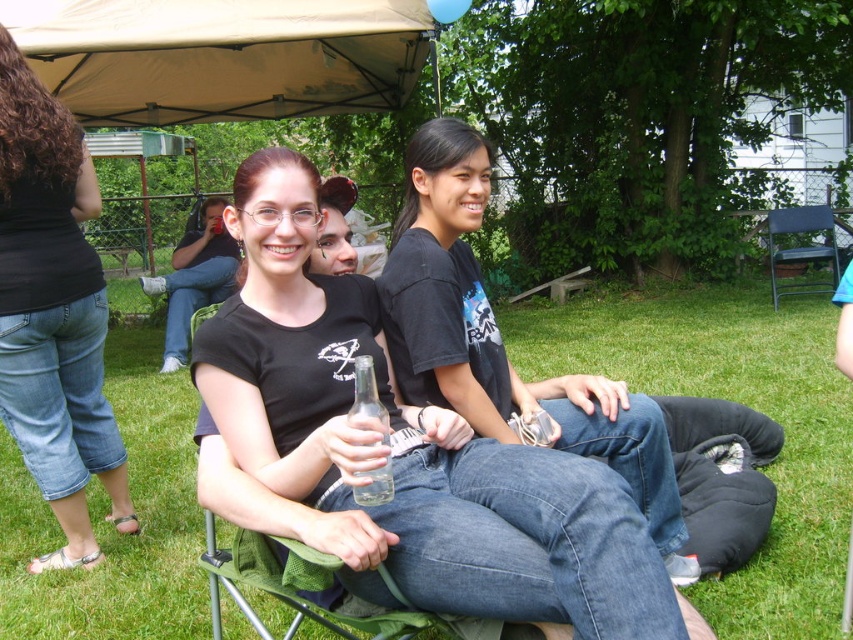
Question: Is tan fabric canopy at upper center smaller than black fabric folding chair at right?

Choices:
 (A) yes
 (B) no

Answer: (B)

Question: Which point is closer to the camera?

Choices:
 (A) (173, 38)
 (B) (608, 577)

Answer: (B)

Question: Among these objects, which one is nearest to the camera?

Choices:
 (A) matte black shirt at center
 (B) tan fabric canopy at upper center

Answer: (A)

Question: Which point is farther to the camera?

Choices:
 (A) black denim jeans at lower left
 (B) tan fabric canopy at upper center

Answer: (B)

Question: Observing the image, what is the correct spatial positioning of black denim jeans at lower left in reference to black fabric folding chair at right?

Choices:
 (A) right
 (B) left

Answer: (B)

Question: Can you confirm if tan fabric canopy at upper center is wider than black fabric folding chair at right?

Choices:
 (A) yes
 (B) no

Answer: (A)